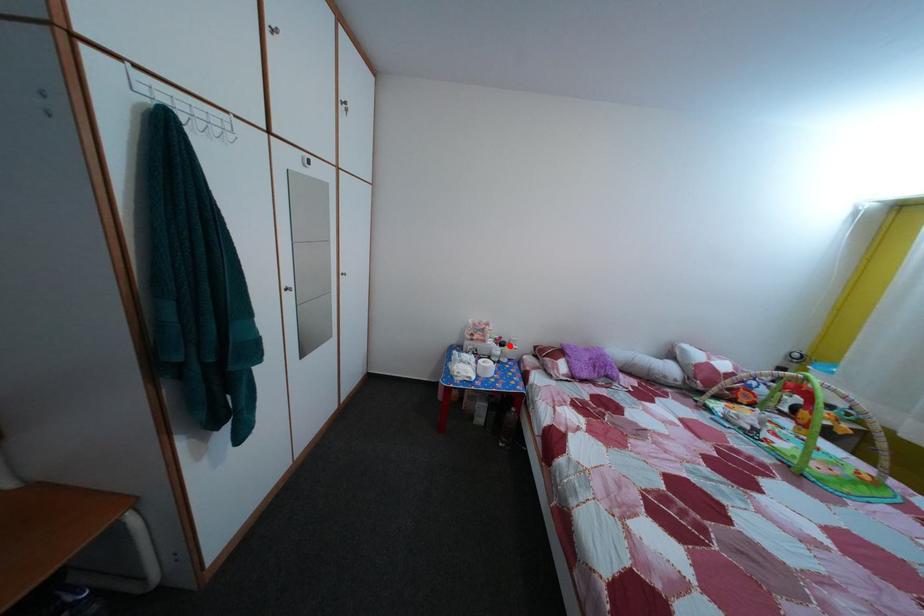
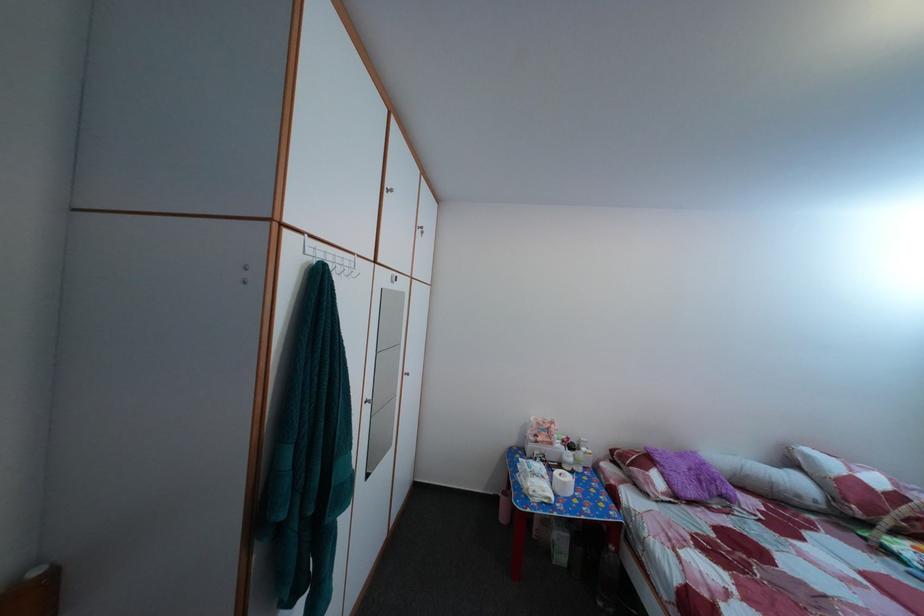
The point at the highlighted location is marked in the first image. Where is the corresponding point in the second image?

(578, 447)